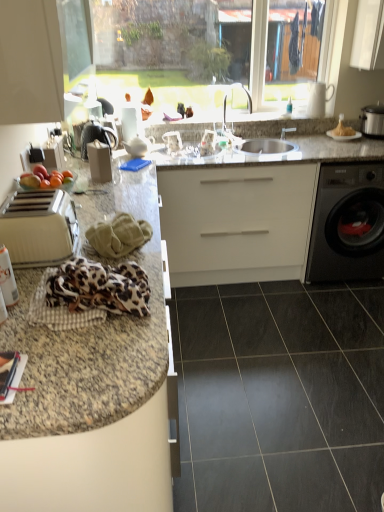
Where is `beige plastic toaster at left`? This screenshot has height=512, width=384. beige plastic toaster at left is located at coordinates (39, 227).

What do you see at coordinates (342, 129) in the screenshot?
I see `golden brown crispy pastry at upper right` at bounding box center [342, 129].

Find the location of `dark gray polished granite at center`. dark gray polished granite at center is located at coordinates (280, 397).

Find the location of `granite at left`. granite at left is located at coordinates (91, 336).

At what (x,y) coordinates should I click in order to perform the action: click on beige plastic toaster at left. Please return your answer as a coordinate pair (x, y). The height and width of the screenshot is (512, 384). Looking at the image, I should click on (39, 227).

Which of these two, satin silver sink at center or silver metallic faucet at center, is wider?

Wider between the two is satin silver sink at center.

Consider the image. Can you tell me how much satin silver sink at center and silver metallic faucet at center differ in facing direction?

They differ by 2.19e-05 degrees in their facing directions.

From a real-world perspective, which object stands above the other?

silver metallic faucet at center, from a real-world perspective.

Are satin silver sink at center and silver metallic faucet at center far apart?

satin silver sink at center is actually quite close to silver metallic faucet at center.

Does transparent glass window at upper center have a lesser height compared to beige plastic toaster at left?

No, transparent glass window at upper center is not shorter than beige plastic toaster at left.

Can you confirm if transparent glass window at upper center is thinner than beige plastic toaster at left?

Yes, transparent glass window at upper center is thinner than beige plastic toaster at left.

Is transparent glass window at upper center directly adjacent to beige plastic toaster at left?

No, transparent glass window at upper center is not with beige plastic toaster at left.

Is transparent glass window at upper center situated inside beige plastic toaster at left or outside?

transparent glass window at upper center is not enclosed by beige plastic toaster at left.

Visually, is granite at left positioned to the left or to the right of beige plastic toaster at left?

In the image, granite at left appears on the right side of beige plastic toaster at left.

From the image's perspective, does granite at left appear higher than beige plastic toaster at left?

No, from the image's perspective, granite at left is not above beige plastic toaster at left.

Would you say granite at left is a long distance from beige plastic toaster at left?

No, granite at left is in close proximity to beige plastic toaster at left.

Consider the image. Does granite at left have a lesser width compared to beige plastic toaster at left?

No, granite at left is not thinner than beige plastic toaster at left.

Between golden brown crispy pastry at upper right and silver metallic faucet at center, which one appears on the left side from the viewer's perspective?

From the viewer's perspective, silver metallic faucet at center appears more on the left side.

Is golden brown crispy pastry at upper right inside or outside of silver metallic faucet at center?

The correct answer is: outside.

From the image's perspective, who appears lower, golden brown crispy pastry at upper right or silver metallic faucet at center?

golden brown crispy pastry at upper right is shown below in the image.

In the scene shown: Is beige plastic toaster at left surrounding white glossy cabinet at upper left?

No, white glossy cabinet at upper left is not a part of beige plastic toaster at left.

Would you consider beige plastic toaster at left to be distant from white glossy cabinet at upper left?

Actually, beige plastic toaster at left and white glossy cabinet at upper left are a little close together.

From the image's perspective, which is below, beige plastic toaster at left or white glossy cabinet at upper left?

From the image's view, beige plastic toaster at left is below.

Considering the sizes of objects beige plastic toaster at left and white glossy cabinet at upper left in the image provided, who is taller, beige plastic toaster at left or white glossy cabinet at upper left?

white glossy cabinet at upper left.

Can you confirm if white glossy plate at upper right is bigger than white glossy cabinet at upper left?

Incorrect, white glossy plate at upper right is not larger than white glossy cabinet at upper left.

Is point (352, 138) less distant than point (31, 113)?

No, (352, 138) is further to viewer.

Is white glossy plate at upper right next to white glossy cabinet at upper left and touching it?

There is a gap between white glossy plate at upper right and white glossy cabinet at upper left.

Which is in front, white glossy plate at upper right or white glossy cabinet at upper left?

white glossy cabinet at upper left.

Is white glossy cabinet at upper left placed right next to satin silver slow cooker at right?

There is a gap between white glossy cabinet at upper left and satin silver slow cooker at right.

Is white glossy cabinet at upper left aimed at satin silver slow cooker at right?

Yes.

From the image's perspective, would you say white glossy cabinet at upper left is positioned over satin silver slow cooker at right?

No, from the image's perspective, white glossy cabinet at upper left is not above satin silver slow cooker at right.

Is white glossy cabinet at upper left taller or shorter than satin silver slow cooker at right?

In the image, white glossy cabinet at upper left appears to be taller than satin silver slow cooker at right.

You are a GUI agent. You are given a task and a screenshot of the screen. Output one action in this format:
    pyautogui.click(x=<x>, y=<y>)
    Task: Click on the sink that is in front of the silver metallic faucet at center
    
    Given the screenshot: What is the action you would take?
    pyautogui.click(x=191, y=144)

I want to click on window above the beige plastic toaster at left (from a real-world perspective), so click(x=159, y=45).

Considering their positions, is satin silver slow cooker at right positioned closer to golden brown crispy pastry at upper right than matte black magazine at lower left?

Among the two, satin silver slow cooker at right is located nearer to golden brown crispy pastry at upper right.

Considering their positions, is matte black magazine at lower left positioned closer to transparent glass window at upper center than silver metallic faucet at center?

Based on the image, silver metallic faucet at center appears to be nearer to transparent glass window at upper center.

Considering their positions, is black glossy washing machine at right positioned further to matte black magazine at lower left than satin silver slow cooker at right?

satin silver slow cooker at right is further to matte black magazine at lower left.

From the image, which object appears to be nearer to dark gray polished granite at center, satin silver slow cooker at right or transparent glass window at upper center?

satin silver slow cooker at right.

Which object lies nearer to the anchor point satin silver slow cooker at right, golden brown crispy pastry at upper right or satin silver sink at center?

golden brown crispy pastry at upper right.

Estimate the real-world distances between objects in this image. Which object is closer to leopard print fabric at lower left, placed as the 1th material when sorted from front to back, granite at left or satin silver slow cooker at right?

Based on the image, granite at left appears to be nearer to leopard print fabric at lower left, placed as the 1th material when sorted from front to back.

Based on their spatial positions, is matte black magazine at lower left or satin silver slow cooker at right closer to white glossy cabinet at upper left?

Among the two, matte black magazine at lower left is located nearer to white glossy cabinet at upper left.

Considering their positions, is beige plastic toaster at left positioned closer to granite at left than leopard print fabric at lower left, arranged as the second material when viewed from the back?

leopard print fabric at lower left, arranged as the second material when viewed from the back, is positioned closer to the anchor granite at left.

Where is `faucet between transparent glass window at upper center and dark gray polished granite at center in the vertical direction`? The height and width of the screenshot is (512, 384). faucet between transparent glass window at upper center and dark gray polished granite at center in the vertical direction is located at coordinates (244, 91).

The height and width of the screenshot is (512, 384). In order to click on material between leopard print fabric at lower left, placed as the 1th material when sorted from front to back, and white glossy plate at upper right, along the z-axis in this screenshot , I will do coord(118,234).

Find the location of a particular element. The width and height of the screenshot is (384, 512). cabinetry that lies between silver metallic faucet at center and dark gray polished granite at center from top to bottom is located at coordinates (30, 62).

You are a GUI agent. You are given a task and a screenshot of the screen. Output one action in this format:
    pyautogui.click(x=<x>, y=<y>)
    Task: Click on the gas stove between white glossy cabinet at upper left and black glossy washing machine at right from left to right
    
    Given the screenshot: What is the action you would take?
    pyautogui.click(x=344, y=136)